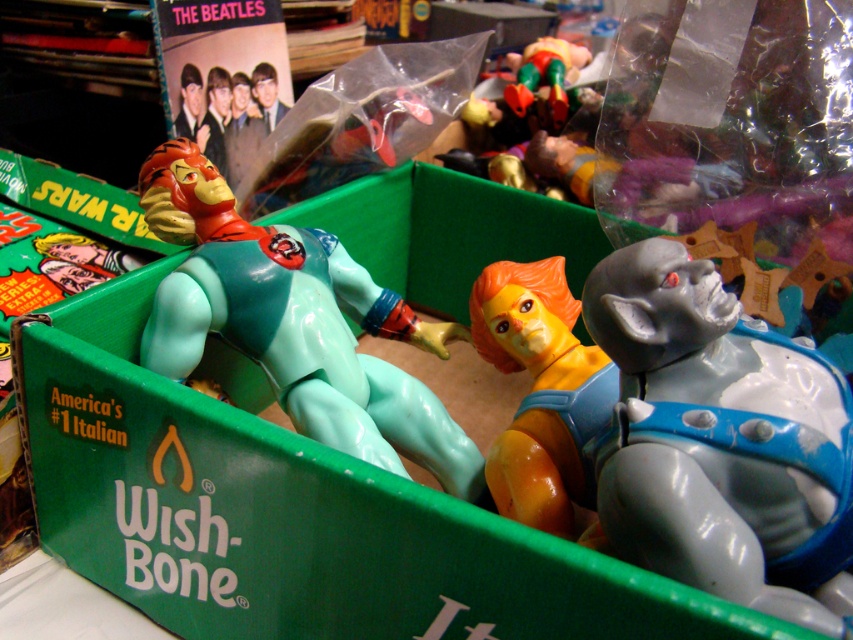
Is light blue plastic figure at center above orange matte figure at center?

Yes.

Is light blue plastic figure at center bigger than orange matte figure at center?

Correct, light blue plastic figure at center is larger in size than orange matte figure at center.

The height and width of the screenshot is (640, 853). I want to click on light blue plastic figure at center, so click(x=296, y=324).

Is gray matte gorilla at center to the left of shiny metallic figure at upper center from the viewer's perspective?

Correct, you'll find gray matte gorilla at center to the left of shiny metallic figure at upper center.

Which is above, gray matte gorilla at center or shiny metallic figure at upper center?

Positioned higher is shiny metallic figure at upper center.

Does point (752, 490) come closer to viewer compared to point (541, 77)?

Yes, it is.

At what (x,y) coordinates should I click in order to perform the action: click on gray matte gorilla at center. Please return your answer as a coordinate pair (x, y). The image size is (853, 640). Looking at the image, I should click on (720, 442).

Can you confirm if light blue plastic figure at center is bigger than shiny metallic figure at upper center?

Indeed, light blue plastic figure at center has a larger size compared to shiny metallic figure at upper center.

Is point (312, 348) positioned before point (520, 67)?

Yes, it is.

In order to click on light blue plastic figure at center in this screenshot , I will do `click(296, 324)`.